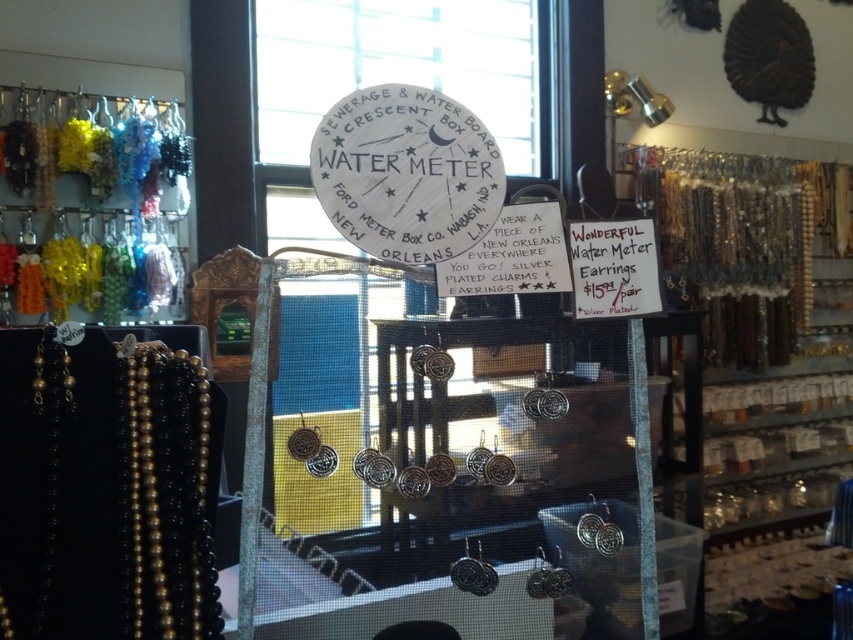
Is point (47, 477) positioned before point (71, 250)?

Yes.

Who is positioned more to the right, black beaded necklace at left or multicolored beads at left?

From the viewer's perspective, black beaded necklace at left appears more on the right side.

Is point (106, 568) closer to viewer compared to point (45, 125)?

Yes, point (106, 568) is in front of point (45, 125).

Where is `black beaded necklace at left`? This screenshot has height=640, width=853. black beaded necklace at left is located at coordinates (105, 490).